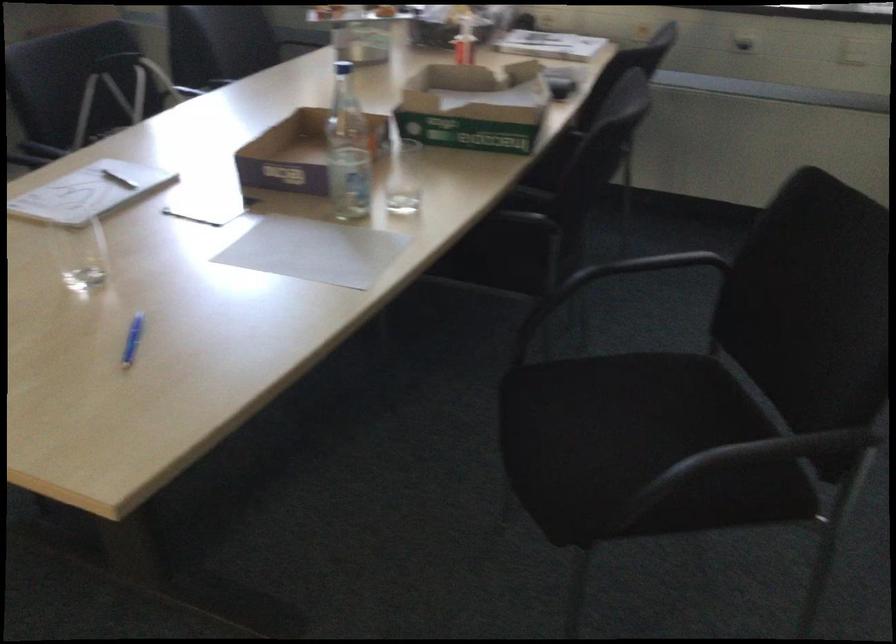
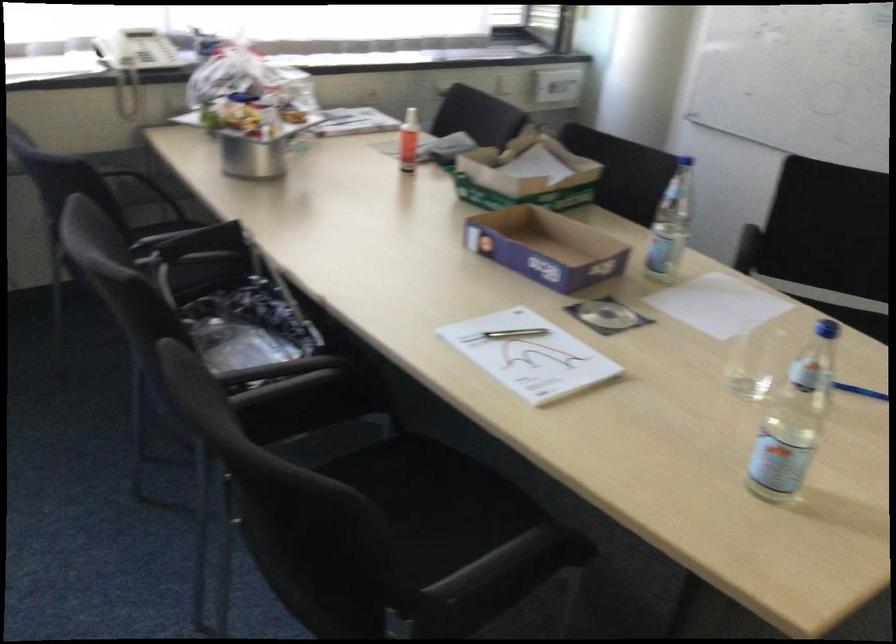
Where in the second image is the point corresponding to point (418, 97) from the first image?

(526, 175)